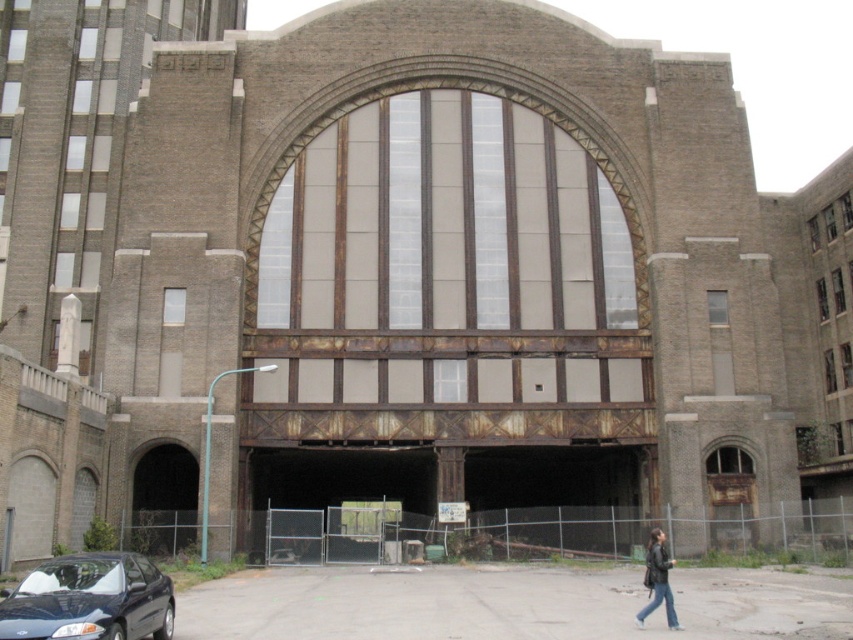
Question: Is shiny black sedan at lower left below black leather jacket at lower right?

Choices:
 (A) no
 (B) yes

Answer: (A)

Question: Can you confirm if shiny black sedan at lower left is smaller than black leather jacket at lower right?

Choices:
 (A) no
 (B) yes

Answer: (A)

Question: Which point is farther to the camera?

Choices:
 (A) black leather jacket at lower right
 (B) shiny black sedan at lower left

Answer: (A)

Question: Can you confirm if shiny black sedan at lower left is smaller than black leather jacket at lower right?

Choices:
 (A) yes
 (B) no

Answer: (B)

Question: Among these points, which one is nearest to the camera?

Choices:
 (A) (662, 588)
 (B) (97, 595)

Answer: (B)